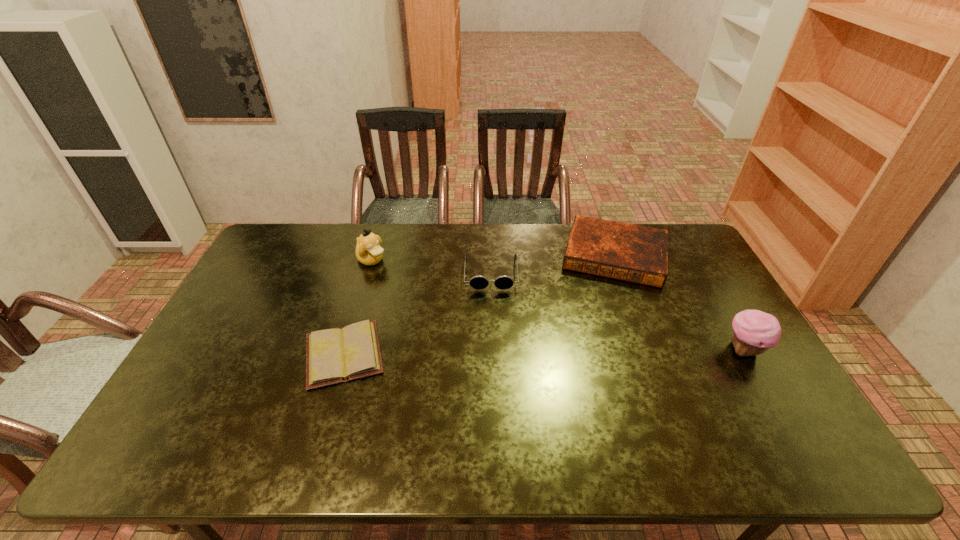
I want to click on the shortest object, so click(337, 355).

Find the location of `cupcake`. cupcake is located at coordinates (754, 332).

This screenshot has height=540, width=960. I want to click on Bible, so click(x=639, y=254).

I want to click on duckling, so click(x=368, y=251).

This screenshot has height=540, width=960. In order to click on sunglasses in this screenshot , I will do `click(478, 282)`.

Where is `vacant space located 0.090m on the right of the diary`? vacant space located 0.090m on the right of the diary is located at coordinates (420, 354).

Locate an element on the screen. This screenshot has height=540, width=960. free spot located on the left of the rightmost object is located at coordinates (682, 350).

Locate an element on the screen. This screenshot has height=540, width=960. vacant area situated 0.070m on the spine side of the fourth object from left to right is located at coordinates (606, 301).

Locate an element on the screen. The height and width of the screenshot is (540, 960). blank space located on the spine side of the fourth object from left to right is located at coordinates (606, 301).

At what (x,y) coordinates should I click in order to perform the action: click on free space located 0.210m on the spine side of the fourth object from left to right. Please return your answer as a coordinate pair (x, y). This screenshot has width=960, height=540. Looking at the image, I should click on (601, 333).